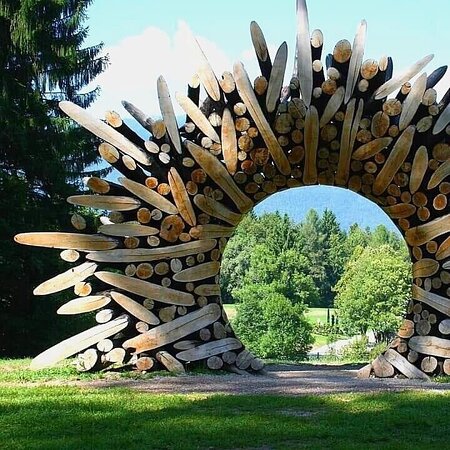
The image size is (450, 450). I want to click on archway, so click(316, 182).